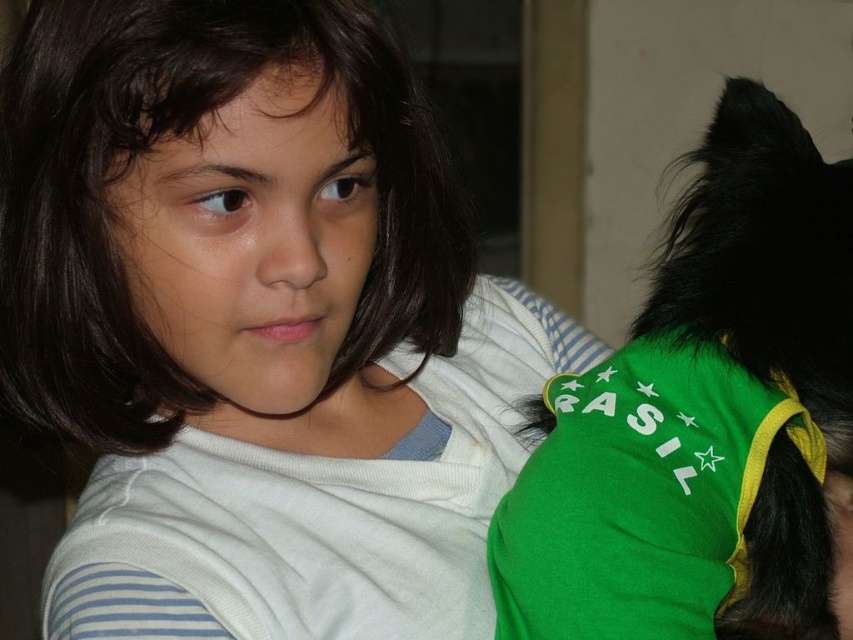
You are a fashion designer observing the image. You need to decide which item is narrower between the green fabric dog at right and the dark brown hair at center. Which one is it?

The green fabric dog at right is thinner than the dark brown hair at center, so the green fabric dog at right is narrower.